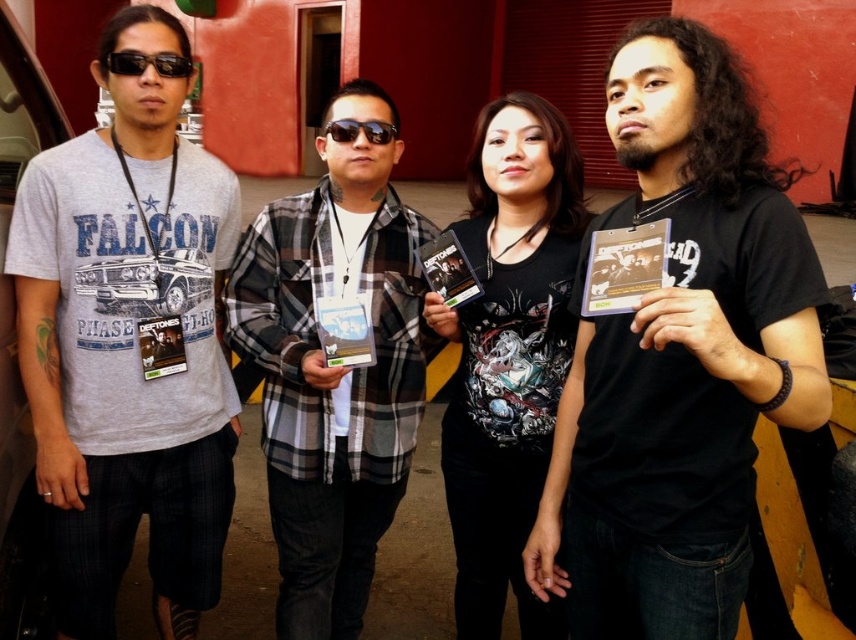
You are organizing a music event and need to arrange promotional materials on a table. You have a matte plastic dvd case at center and a matte black album at left. According to the image, which item should be placed to the right of the other?

The matte plastic dvd case at center is positioned on the right side of the matte black album at left, so the matte plastic dvd case at center should be placed to the right of the matte black album at left.